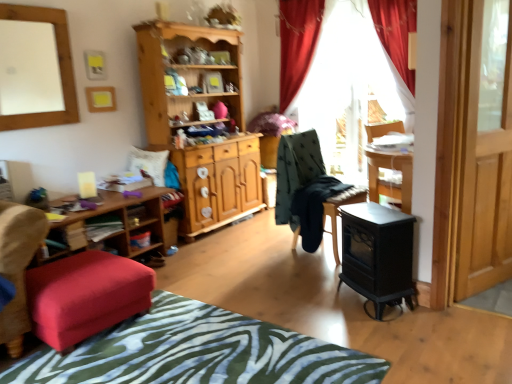
This screenshot has height=384, width=512. What are the coordinates of `vacant area that is in front of black matte wood stove at lower right` in the screenshot? It's located at (392, 330).